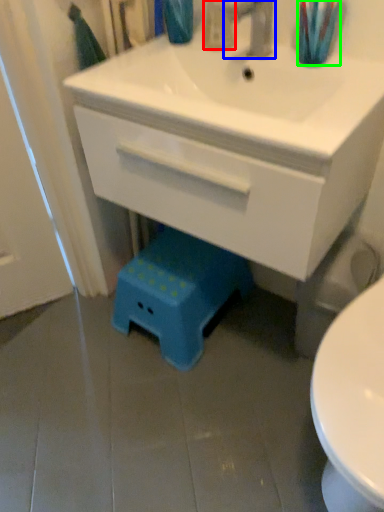
Question: Based on their relative distances, which object is nearer to toiletry (highlighted by a red box)? Choose from tap (highlighted by a blue box) and toothbrush (highlighted by a green box).

Choices:
 (A) tap
 (B) toothbrush

Answer: (A)